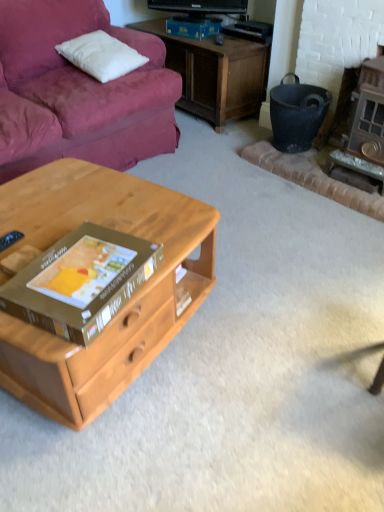
This screenshot has height=512, width=384. I want to click on vacant area on top of brown cardboard box at center (from a real-world perspective), so click(x=91, y=263).